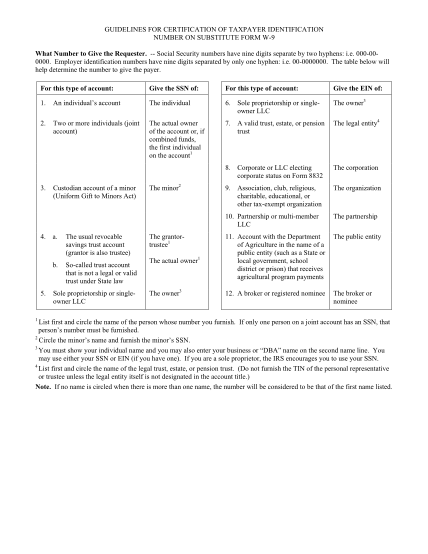
In order to click on column in this screenshot , I will do `click(101, 143)`.